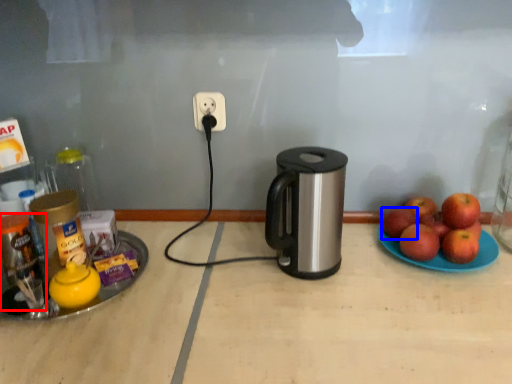
Question: Which object is further to the camera taking this photo, bottle (highlighted by a red box) or apple (highlighted by a blue box)?

Choices:
 (A) bottle
 (B) apple

Answer: (B)